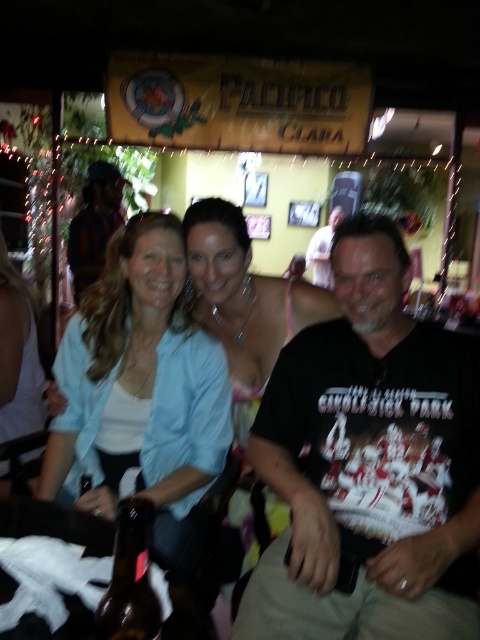
Question: Among these points, which one is farthest from the camera?

Choices:
 (A) (x=350, y=348)
 (B) (x=82, y=252)

Answer: (B)

Question: Which point is farther to the camera?

Choices:
 (A) matte silver necklace at center
 (B) dark brown leather jacket at center
 (C) white t-shirt at center
 (D) black cotton t-shirt at center

Answer: (C)

Question: Is black cotton t-shirt at center to the right of dark brown leather jacket at center from the viewer's perspective?

Choices:
 (A) no
 (B) yes

Answer: (B)

Question: Estimate the real-world distances between objects in this image. Which object is closer to the matte silver necklace at center?

Choices:
 (A) dark brown leather jacket at center
 (B) white t-shirt at center

Answer: (A)

Question: Is dark brown leather jacket at center below white t-shirt at center?

Choices:
 (A) no
 (B) yes

Answer: (B)

Question: Can you confirm if light blue shirt at center is positioned to the left of white t-shirt at center?

Choices:
 (A) no
 (B) yes

Answer: (B)